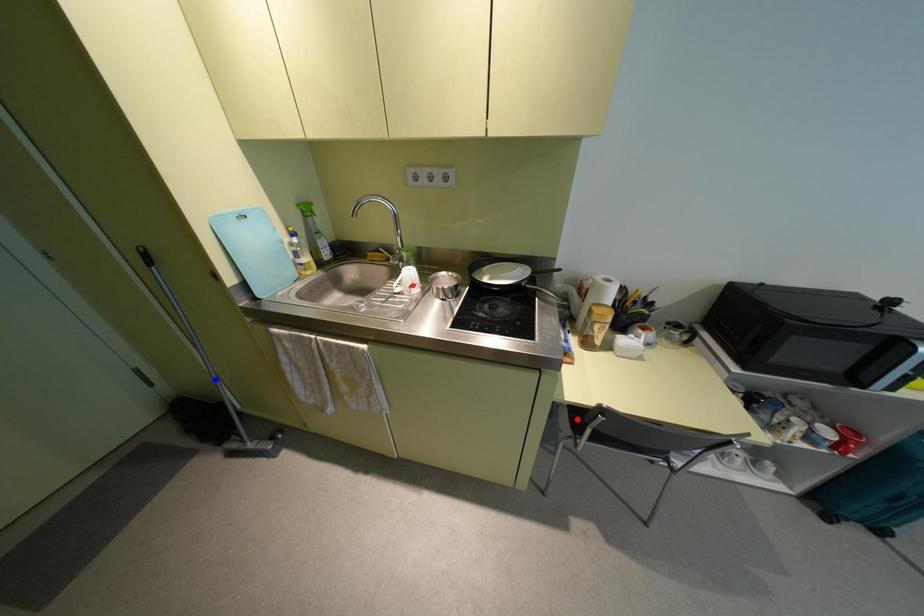
Question: Two points are marked on the image. Which point is closer to the camera?

Choices:
 (A) Blue point is closer.
 (B) Red point is closer.

Answer: (B)